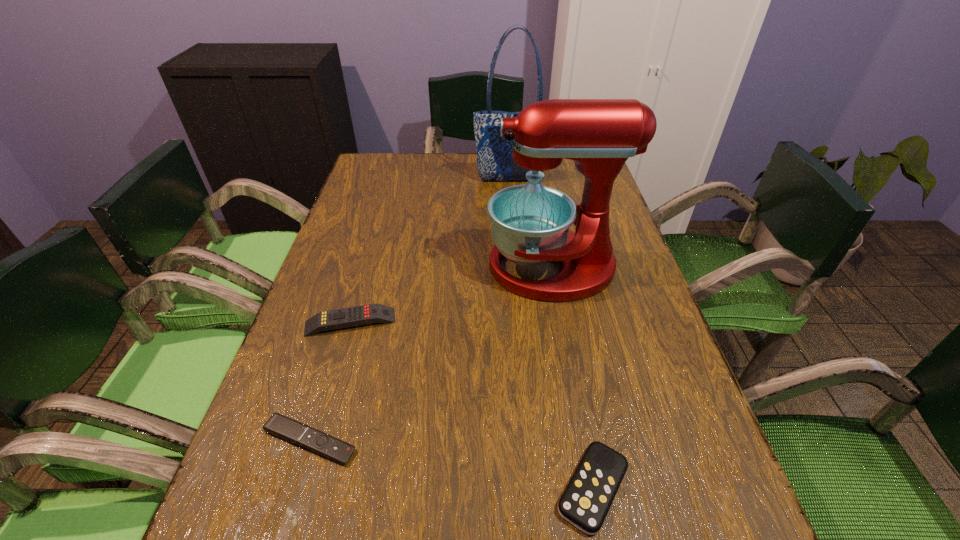
Identify the location of vacant position in the image that satisfies the following two spatial constraints: 1. on the front-facing side of the mixer; 2. on the front side of the farthest remote control. (563, 322).

Where is `free location that satisfies the following two spatial constraints: 1. on the front side of the second tallest remote control; 2. on the right side of the shortest object`? Image resolution: width=960 pixels, height=540 pixels. free location that satisfies the following two spatial constraints: 1. on the front side of the second tallest remote control; 2. on the right side of the shortest object is located at coordinates (296, 488).

The height and width of the screenshot is (540, 960). Find the location of `vacant area in the image that satisfies the following two spatial constraints: 1. on the back side of the second tallest remote control; 2. on the front-facing side of the mixer`. vacant area in the image that satisfies the following two spatial constraints: 1. on the back side of the second tallest remote control; 2. on the front-facing side of the mixer is located at coordinates (552, 267).